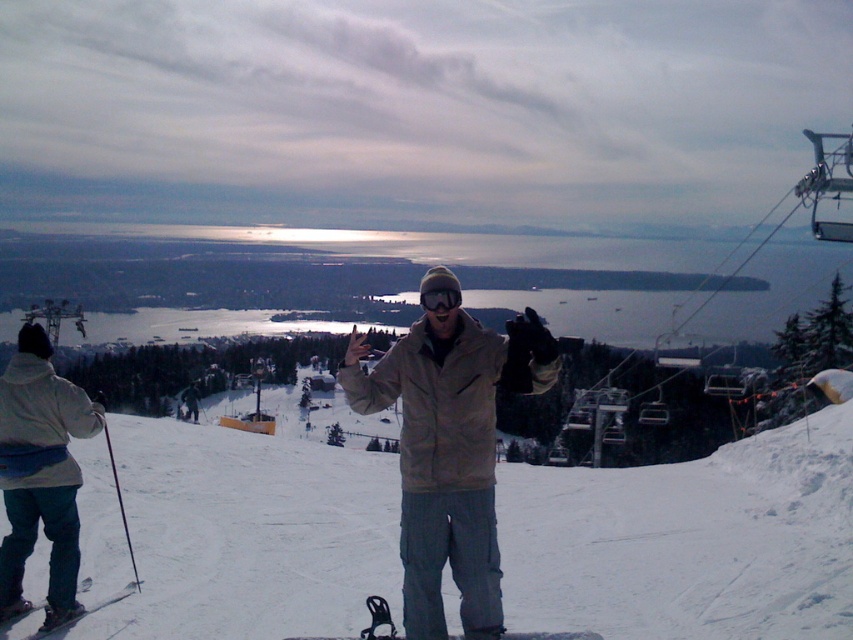
Question: Is beige textured jacket at center below white fleece jacket at lower left?

Choices:
 (A) no
 (B) yes

Answer: (A)

Question: Considering the relative positions of beige textured jacket at center and black matte goggles at center in the image provided, where is beige textured jacket at center located with respect to black matte goggles at center?

Choices:
 (A) above
 (B) below

Answer: (B)

Question: Which point is closer to the camera?

Choices:
 (A) (575, 636)
 (B) (422, 413)
 (C) (96, 420)
 (D) (90, 579)

Answer: (B)

Question: Which point is farther to the camera?

Choices:
 (A) [x=80, y=614]
 (B) [x=438, y=298]

Answer: (A)

Question: Can you confirm if black matte snowboard at center is positioned to the left of black matte goggles at center?

Choices:
 (A) no
 (B) yes

Answer: (A)

Question: Which point is closer to the camera?

Choices:
 (A) beige textured jacket at center
 (B) black matte goggles at center

Answer: (A)